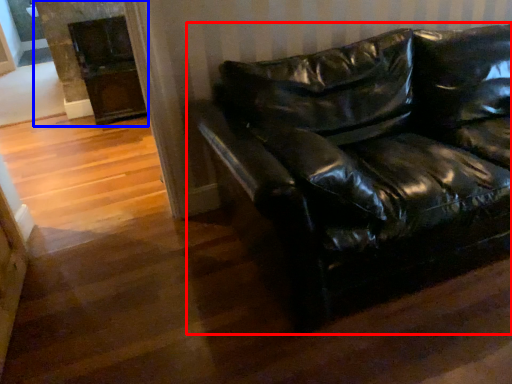
Question: Which of the following is the closest to the observer, studio couch (highlighted by a red box) or fireplace (highlighted by a blue box)?

Choices:
 (A) studio couch
 (B) fireplace

Answer: (A)